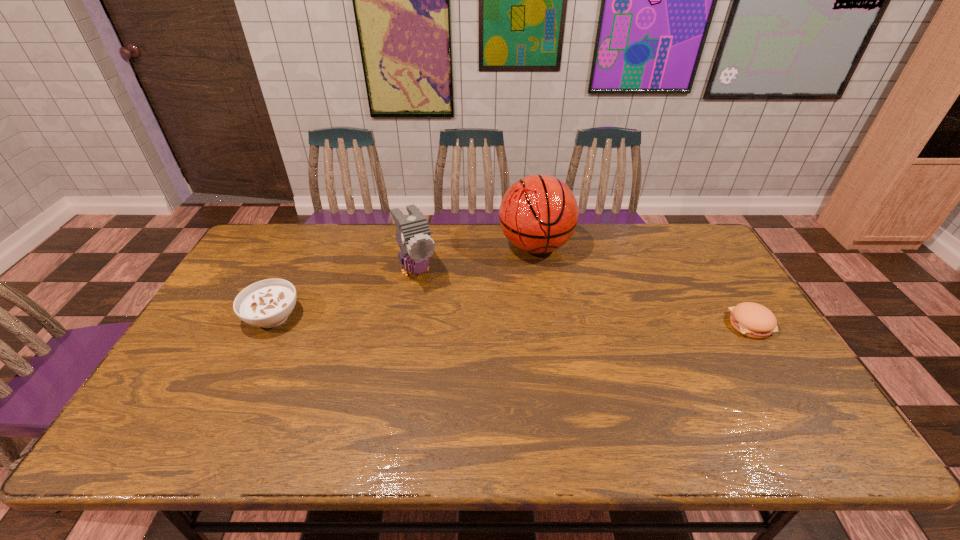
Where is `soup bowl`? soup bowl is located at coordinates (268, 303).

Find the location of a particular element. The width and height of the screenshot is (960, 540). the third tallest object is located at coordinates (268, 303).

Identify the location of the rightmost object. (751, 319).

This screenshot has width=960, height=540. I want to click on the shortest object, so click(x=751, y=319).

Where is `the second object from left to right`? This screenshot has height=540, width=960. the second object from left to right is located at coordinates (413, 235).

You are a GUI agent. You are given a task and a screenshot of the screen. Output one action in this format:
    pyautogui.click(x=<x>, y=<y>)
    Task: Click on the bird
    This screenshot has width=960, height=540.
    Given the screenshot: What is the action you would take?
    pyautogui.click(x=413, y=235)

The width and height of the screenshot is (960, 540). What are the coordinates of `the tallest object` in the screenshot? It's located at 538,214.

Where is `the third object from left to right`? This screenshot has height=540, width=960. the third object from left to right is located at coordinates (538, 214).

I want to click on vacant space located 0.090m on the back of the leftmost object, so click(x=292, y=278).

I want to click on free space located on the left of the shortest object, so click(x=694, y=325).